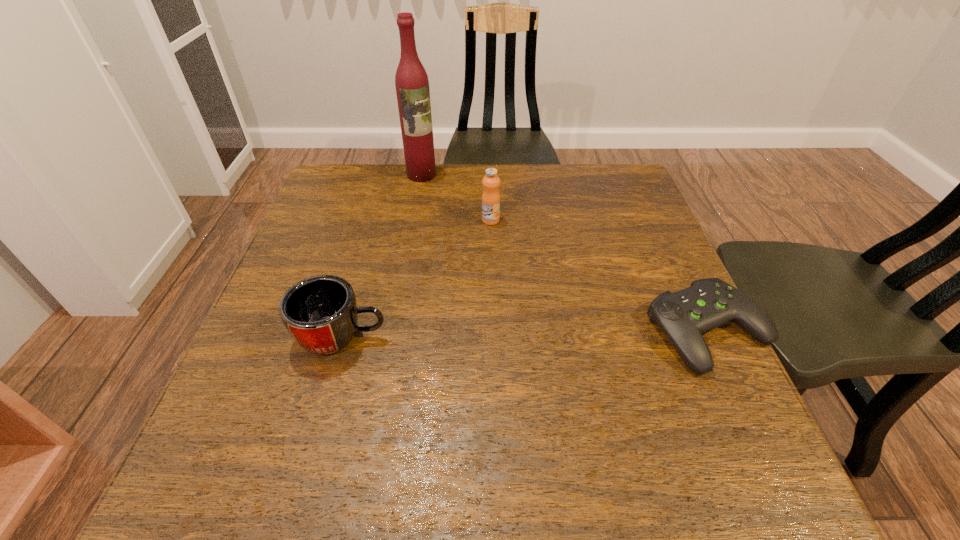
Image resolution: width=960 pixels, height=540 pixels. Identify the location of vacant space situated on the front label of the second farthest object. (488, 291).

You are a GUI agent. You are given a task and a screenshot of the screen. Output one action in this format:
    pyautogui.click(x=<x>, y=<y>)
    Task: Click on the free space located 0.260m on the front label of the second farthest object
    This screenshot has width=960, height=540.
    Given the screenshot: What is the action you would take?
    click(488, 301)

You are a GUI agent. You are given a task and a screenshot of the screen. Output one action in this format:
    pyautogui.click(x=<x>, y=<y>)
    Task: Click on the vacant region located on the label of the farthest object
    The height and width of the screenshot is (540, 960).
    Given the screenshot: What is the action you would take?
    pyautogui.click(x=451, y=218)

I want to click on vacant region located 0.100m on the label of the farthest object, so click(x=439, y=200).

At what (x,y) coordinates should I click in order to perform the action: click on vacant space located on the label of the farthest object. Please return your answer as a coordinate pair (x, y). The height and width of the screenshot is (540, 960). Looking at the image, I should click on (461, 231).

Locate an element on the screen. This screenshot has height=540, width=960. object that is at the far edge is located at coordinates (411, 80).

Locate an element on the screen. The image size is (960, 540). object that is at the left edge is located at coordinates (320, 313).

The width and height of the screenshot is (960, 540). Identify the location of object located in the right edge section of the desktop. (684, 315).

In order to click on vacant space at the far edge in this screenshot , I will do `click(535, 185)`.

Identify the location of vacant region at the near edge of the desktop. (479, 426).